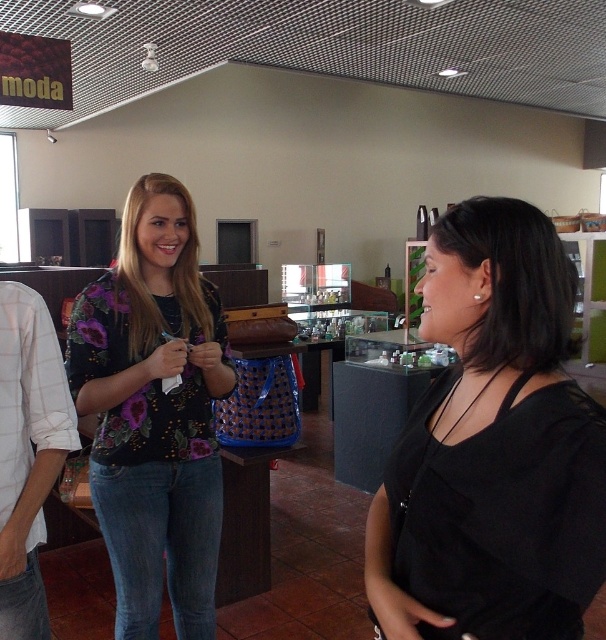
Question: Can you confirm if black matte shirt at center is smaller than floral-patterned shirt at center?

Choices:
 (A) yes
 (B) no

Answer: (A)

Question: Which of the following is the closest to the observer?

Choices:
 (A) (224, 368)
 (B) (453, 612)

Answer: (B)

Question: Considering the relative positions of black matte shirt at center and floral-patterned shirt at center in the image provided, where is black matte shirt at center located with respect to floral-patterned shirt at center?

Choices:
 (A) left
 (B) right

Answer: (B)

Question: Which point is farther from the camera taking this photo?

Choices:
 (A) (121, 225)
 (B) (567, 412)

Answer: (A)

Question: Can you confirm if black matte shirt at center is bigger than floral-patterned shirt at center?

Choices:
 (A) no
 (B) yes

Answer: (A)